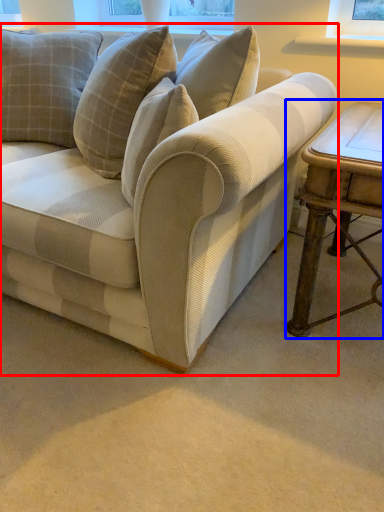
Question: Which of the following is the farthest to the observer, studio couch (highlighted by a red box) or table (highlighted by a blue box)?

Choices:
 (A) studio couch
 (B) table

Answer: (B)